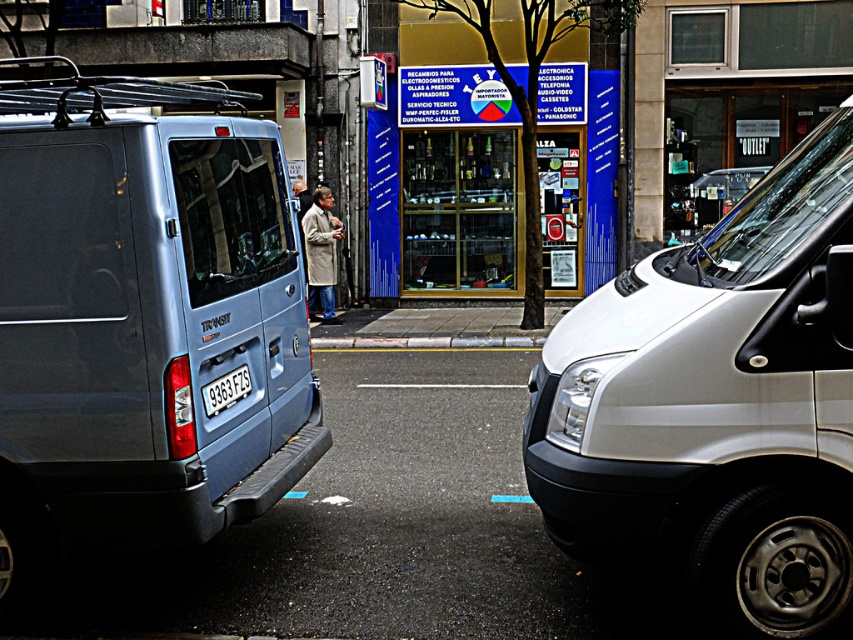
You are a delivery person standing at the camera position. You need to load a package onto the matte blue van at left. The package requires a minimum of 4 meters of clearance from the camera to safely maneuver. Is the distance sufficient?

The matte blue van at left is 4.27 meters away from camera, which is more than the required 4 meters. Therefore, the distance is sufficient for safely maneuvering the package onto the matte blue van at left.

You are a delivery driver who needs to park your vehicle between the matte blue van at left and the gray concrete curb at center. Can you safely park your vehicle here?

The matte blue van at left is positioned on the left side of gray concrete curb at center, so there is space between them for the delivery driver to park safely.

You are standing on the sidewalk in the street scene. You need to locate the white metallic van at right. What are the coordinates where you should look to find it?

The white metallic van at right is located at coordinates point (717, 408).